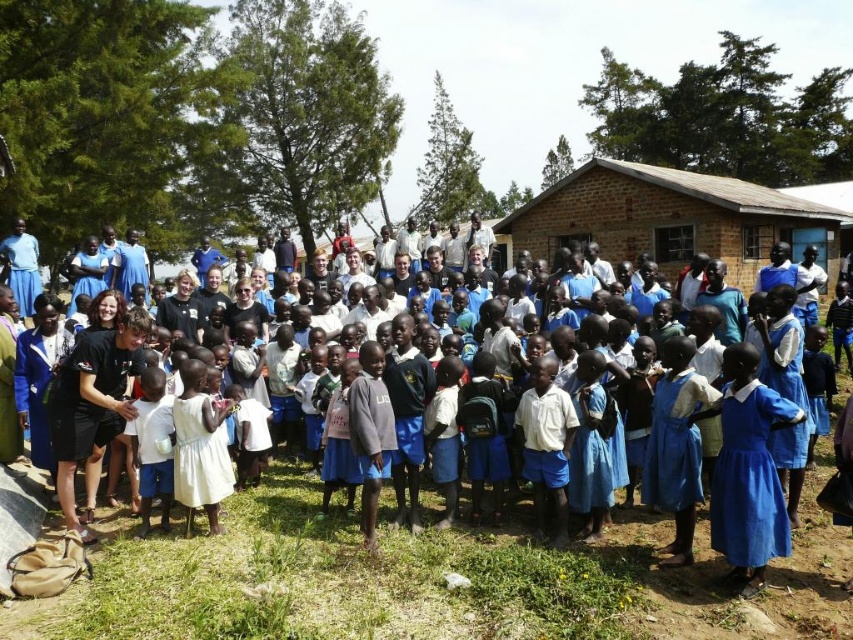
You are a photographer taking a picture of the brown brick hut at center and the blue matte dress at lower right. Which object should you focus on first if you want to capture both in sharp focus?

The brown brick hut at center is much taller than the blue matte dress at lower right, so you should focus on the brown brick hut at center first to ensure both are in sharp focus.

You are a photographer taking a group photo of the children. You notice the black fabric dress at center and the blue matte dress at lower right. Which dress should you focus on to ensure the larger one is in sharp focus?

You should focus on the black fabric dress at center because it is larger in size than the blue matte dress at lower right, so it requires more precise focus to capture details clearly.

You are a photographer taking a picture of the group. You notice two dresses in the frame, the black fabric dress at center and the blue matte dress at lower right. Which dress is positioned to the left of the other?

The black fabric dress at center is to the left of the blue matte dress at lower right.